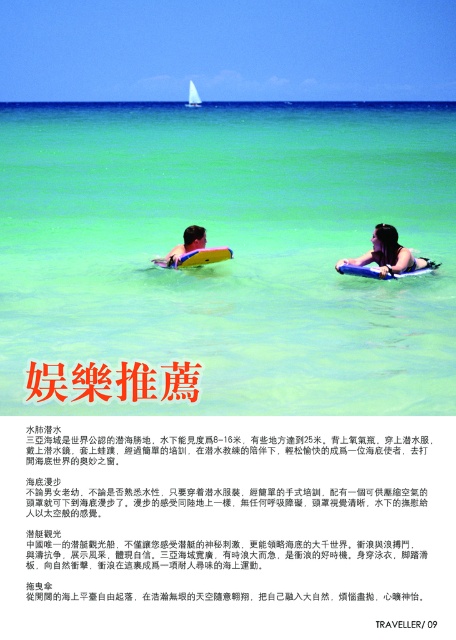
Which is in front, point (398, 273) or point (176, 253)?

Point (398, 273)

Is point (384, 262) positioned behind point (182, 250)?

No, it is in front of (182, 250).

Find the location of a particular element. This screenshot has width=456, height=640. matte blue foam board at upper center is located at coordinates (387, 253).

Can you confirm if transparent blue water at center is thinner than matte black surfboard at center?

No, transparent blue water at center is not thinner than matte black surfboard at center.

Does transparent blue water at center lie behind matte black surfboard at center?

No, transparent blue water at center is closer to the viewer.

What do you see at coordinates (233, 250) in the screenshot? I see `transparent blue water at center` at bounding box center [233, 250].

I want to click on transparent blue water at center, so click(233, 250).

Is transparent blue water at center closer to the viewer compared to matte blue foam board at upper center?

Yes, it is.

Does transparent blue water at center appear on the left side of matte blue foam board at upper center?

Correct, you'll find transparent blue water at center to the left of matte blue foam board at upper center.

Is point (21, 285) positioned behind point (362, 262)?

Yes, point (21, 285) is behind point (362, 262).

The width and height of the screenshot is (456, 640). Identify the location of transparent blue water at center. (233, 250).